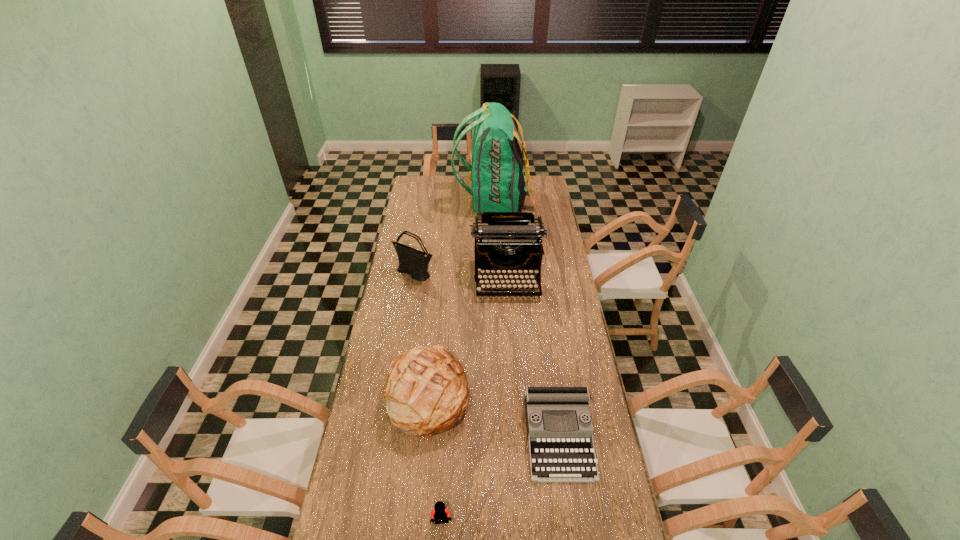
The image size is (960, 540). I want to click on vacant region located on the typing side of the farther typewriter, so click(513, 348).

Where is `free region located on the back of the shoulder bag`? The image size is (960, 540). free region located on the back of the shoulder bag is located at coordinates (421, 231).

Locate an element on the screen. free space located 0.360m on the right of the bread is located at coordinates (564, 393).

Identify the location of free spot located 0.110m on the typing side of the nearer typewriter. This screenshot has width=960, height=540. (570, 519).

This screenshot has width=960, height=540. I want to click on object at the far edge, so click(x=497, y=179).

This screenshot has height=540, width=960. I want to click on shoulder bag at the left edge, so click(415, 263).

Find the location of `bread present at the left edge`. bread present at the left edge is located at coordinates (426, 392).

Where is `backpack at the right edge`? backpack at the right edge is located at coordinates (497, 179).

The width and height of the screenshot is (960, 540). What are the coordinates of `object located in the far right corner section of the desktop` in the screenshot? It's located at [497, 179].

The height and width of the screenshot is (540, 960). Identify the location of vacant space at the far edge. (449, 190).